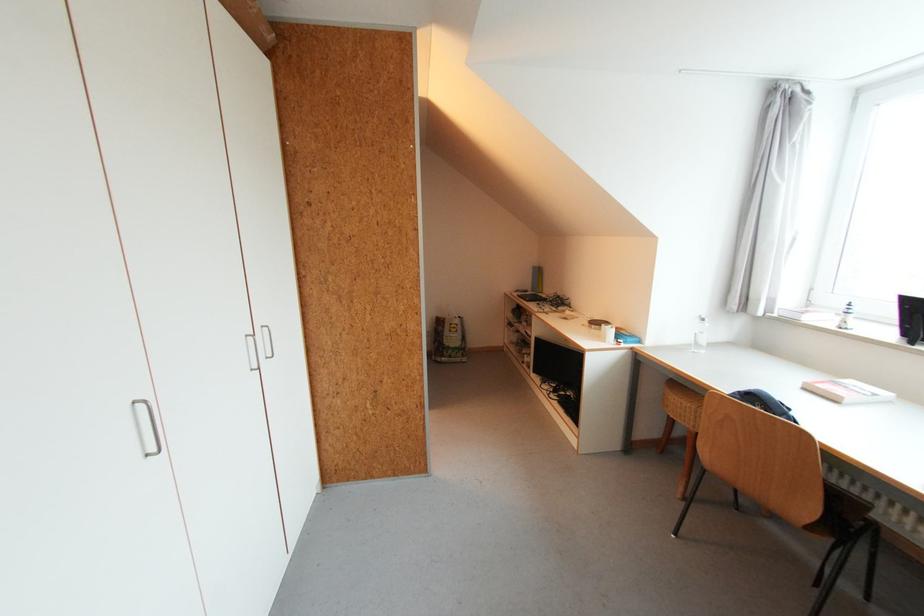
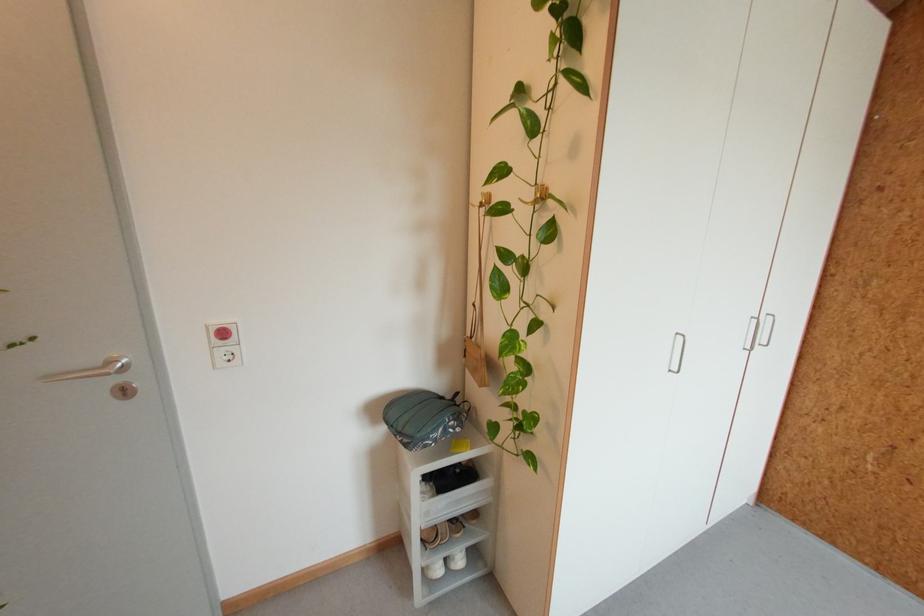
Question: How did the camera likely rotate?

Choices:
 (A) Left
 (B) Right
 (C) Up
 (D) Down

Answer: (A)